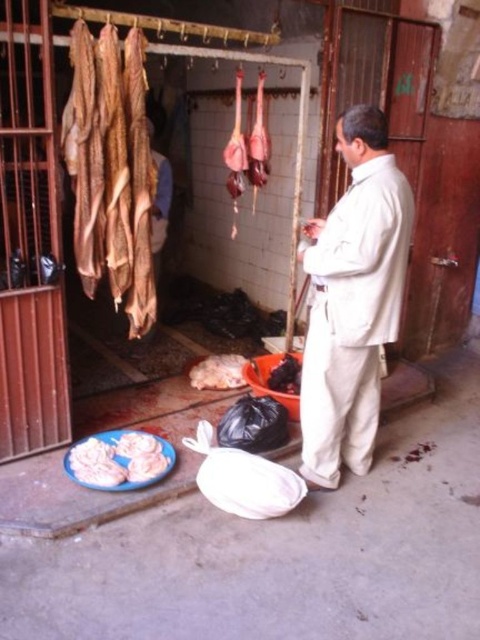
Between point (144, 160) and point (215, 360), which one is positioned behind?

Point (215, 360)

Can you confirm if brown leather hides at upper left is positioned below white soft meat at center?

No, brown leather hides at upper left is not below white soft meat at center.

Is point (97, 268) farther from camera compared to point (192, 376)?

No, it is in front of (192, 376).

Where is `brown leather hides at upper left`? brown leather hides at upper left is located at coordinates [112, 170].

Does brown leather hides at upper left lie in front of white fluffy bread at lower left?

That is True.

Does brown leather hides at upper left have a larger size compared to white fluffy bread at lower left?

Yes.

Is point (120, 157) farther from viewer compared to point (152, 468)?

No, it is not.

The height and width of the screenshot is (640, 480). Identify the location of brown leather hides at upper left. (112, 170).

Describe the element at coordinates (120, 460) in the screenshot. I see `white fluffy bread at lower left` at that location.

Can you confirm if white fluffy bread at lower left is shorter than black glossy meat at center?

Yes, white fluffy bread at lower left is shorter than black glossy meat at center.

Is point (141, 445) farther from viewer compared to point (292, 369)?

No, it is in front of (292, 369).

Locate an element on the screen. The height and width of the screenshot is (640, 480). white fluffy bread at lower left is located at coordinates click(120, 460).